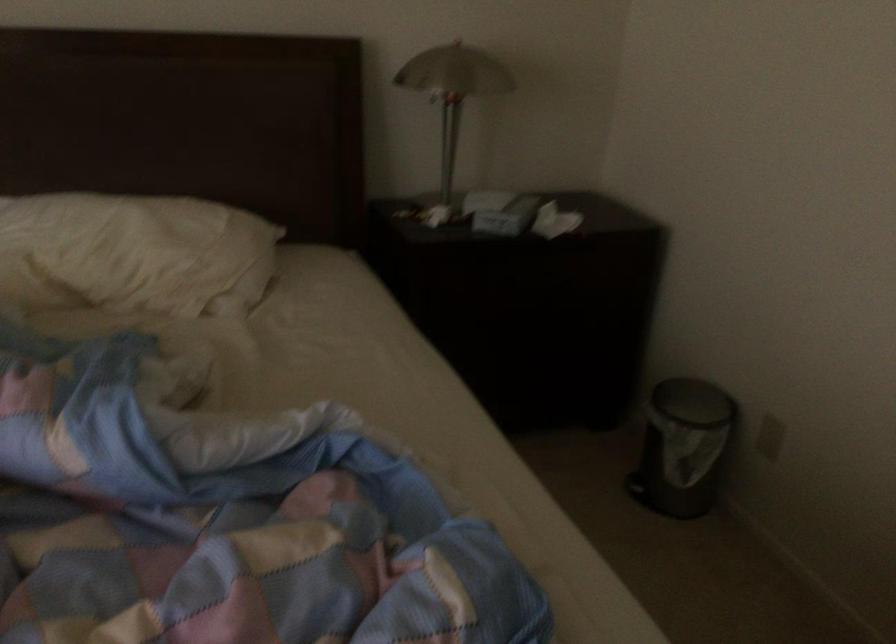
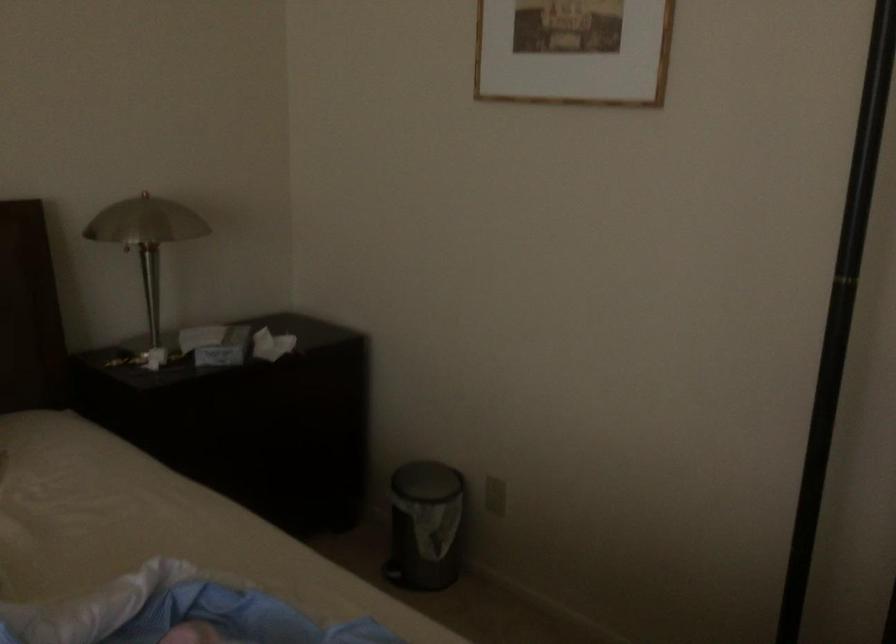
Where in the second image is the point corresponding to pixel 673 448 from the first image?

(425, 526)